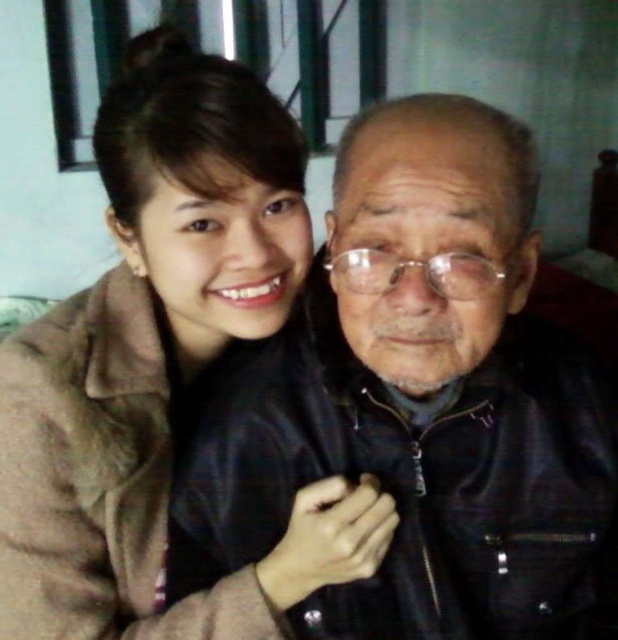
Question: Does leather jacket at center appear under brown fuzzy coat at upper left?

Choices:
 (A) no
 (B) yes

Answer: (B)

Question: Which of the following is the farthest from the observer?

Choices:
 (A) (x=166, y=474)
 (B) (x=368, y=115)

Answer: (A)

Question: Among these points, which one is farthest from the camera?

Choices:
 (A) (277, 289)
 (B) (488, 252)

Answer: (A)

Question: Is leather jacket at center further to camera compared to brown fuzzy coat at upper left?

Choices:
 (A) no
 (B) yes

Answer: (A)

Question: Is leather jacket at center to the left of brown fuzzy coat at upper left from the viewer's perspective?

Choices:
 (A) yes
 (B) no

Answer: (B)

Question: Which object is farther from the camera taking this photo?

Choices:
 (A) leather jacket at center
 (B) brown fuzzy coat at upper left

Answer: (B)